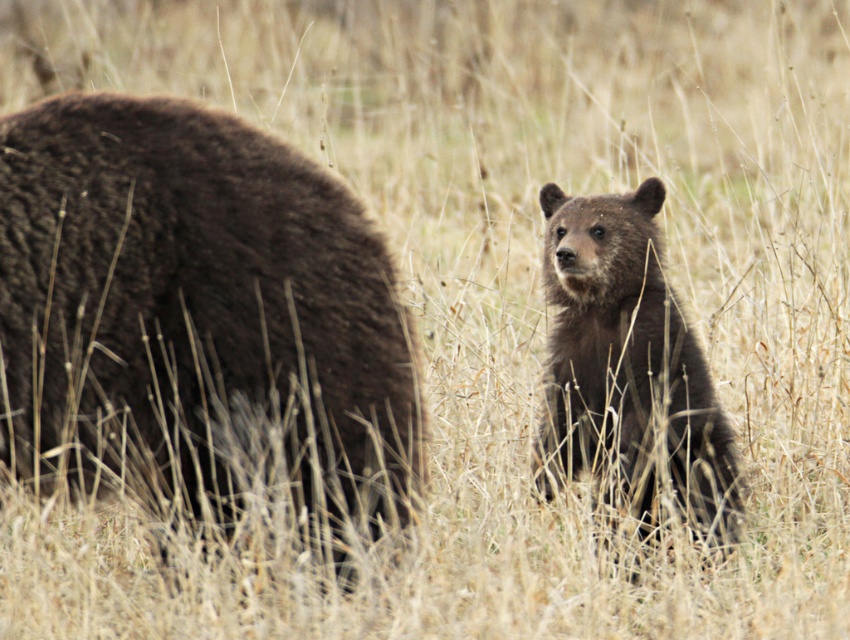
This screenshot has height=640, width=850. Describe the element at coordinates (194, 310) in the screenshot. I see `dark brown fur at left` at that location.

Does dark brown fur at left appear on the left side of dark brown fur bear at center?

Yes, dark brown fur at left is to the left of dark brown fur bear at center.

Between point (75, 227) and point (672, 445), which one is positioned behind?

The point (672, 445) is more distant.

Locate an element on the screen. The width and height of the screenshot is (850, 640). dark brown fur at left is located at coordinates (194, 310).